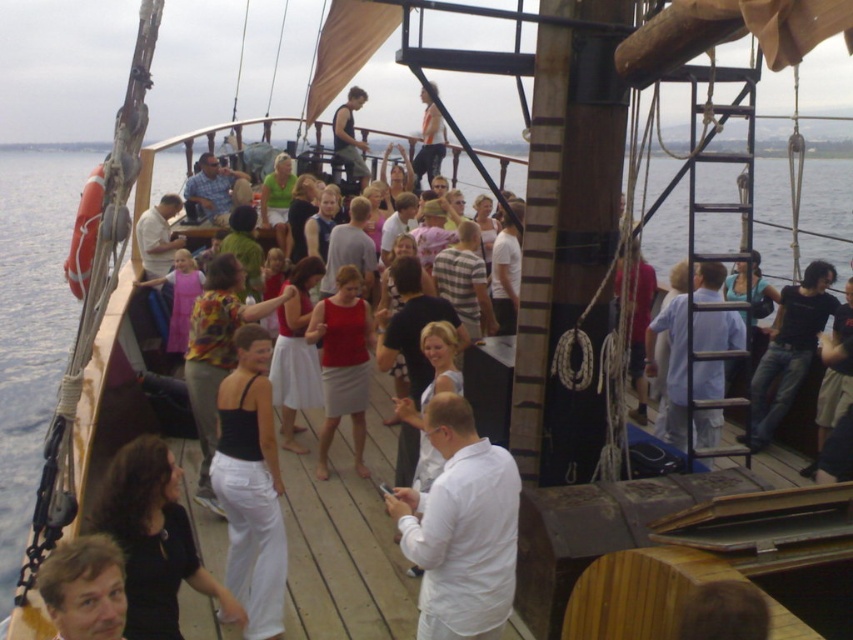
Question: Which of the following is the closest to the observer?

Choices:
 (A) light blue fabric shirt at right
 (B) dark gray fabric shirt at upper center
 (C) matte red tank top at center
 (D) white matte shirt at center

Answer: (D)

Question: Which of the following is the farthest from the observer?

Choices:
 (A) (340, 156)
 (B) (421, 531)
 (C) (225, 481)

Answer: (A)

Question: From the image, what is the correct spatial relationship of light blue fabric shirt at right in relation to matte red tank top at center?

Choices:
 (A) right
 (B) left

Answer: (A)

Question: Which is nearer to the dark gray fabric shirt at upper center?

Choices:
 (A) light blue fabric shirt at right
 (B) black matte tank top at center
 (C) floral fabric dress at center

Answer: (C)

Question: Does white matte shirt at center have a smaller size compared to matte red tank top at center?

Choices:
 (A) no
 (B) yes

Answer: (A)

Question: Is black matte tank top at center below floral fabric dress at center?

Choices:
 (A) no
 (B) yes

Answer: (B)